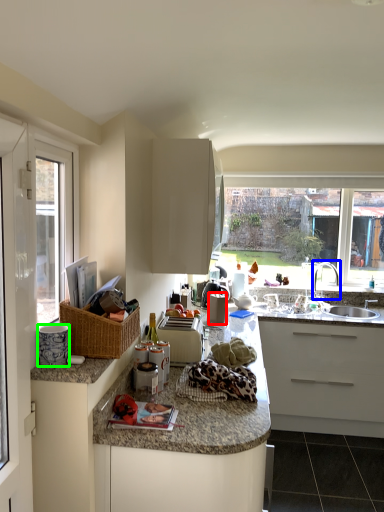
Question: Considering the real-world distances, which object is closest to appliance (highlighted by a red box)? tap (highlighted by a blue box) or appliance (highlighted by a green box).

Choices:
 (A) tap
 (B) appliance

Answer: (A)